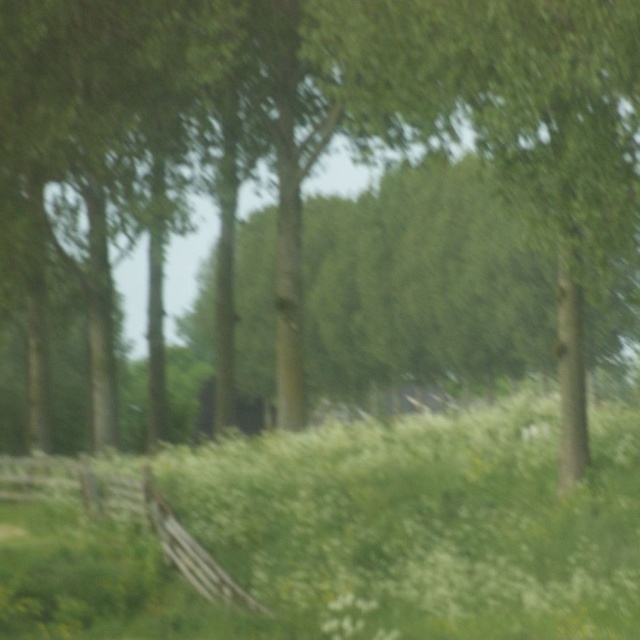
You are a photographer trying to capture a clear shot of the green leafy grass at lower center and the wooden fence at lower left. Considering the image is somewhat blurred, which object would be easier to focus on due to its size?

The green leafy grass at lower center is larger in size than the wooden fence at lower left, so it would be easier to focus on the green leafy grass at lower center because larger objects are generally easier to focus on in a blurred image.

You are standing in the meadow and see two points in the image. Which point is closer to you, point (x=516, y=600) or point (x=54, y=460)?

Point (x=516, y=600) is in front of point (x=54, y=460), so it is closer to you.